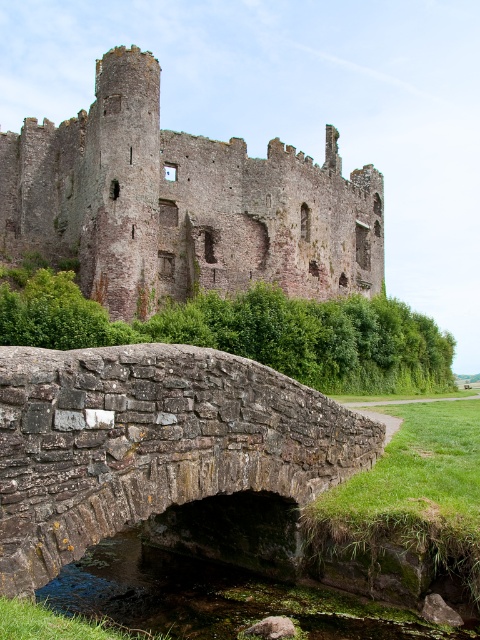
Consider the image. You are a tourist standing at the base of the hill, looking up at the rustic stone castle at upper center and the rusty stone bridge at center. Which structure is closer to you?

The rusty stone bridge at center is behind the rustic stone castle at upper center, so the castle is closer to you.

You are a tourist visiting the historic site and want to take a photo that includes both the rustic stone castle at upper center and the rusty stone bridge at center. Given their sizes, which object should you frame closer to the center of your photo to ensure both are visible?

The rustic stone castle at upper center is larger in size than the rusty stone bridge at center. To ensure both are visible in the photo, you should frame the rustic stone castle at upper center closer to the center of your photo since it is larger and might require more space to capture its details while still allowing the smaller bridge to be included in the frame.

You are a tourist visiting the historic site and want to take a photo that includes both the rustic stone castle at upper center and the rusty stone bridge at center. Based on their relative sizes in the image, which one should you position closer to the center of your camera frame to ensure both are visible without cropping?

The rustic stone castle at upper center is taller than the rusty stone bridge at center. To ensure both are visible without cropping, position the taller rustic stone castle at upper center closer to the center of your camera frame, as it requires more space vertically.